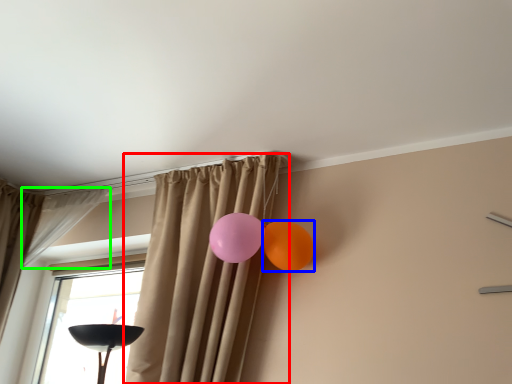
Question: Estimate the real-world distances between objects in this image. Which object is farther from curtain (highlighted by a red box), balloon (highlighted by a blue box) or curtain (highlighted by a green box)?

Choices:
 (A) balloon
 (B) curtain

Answer: (B)